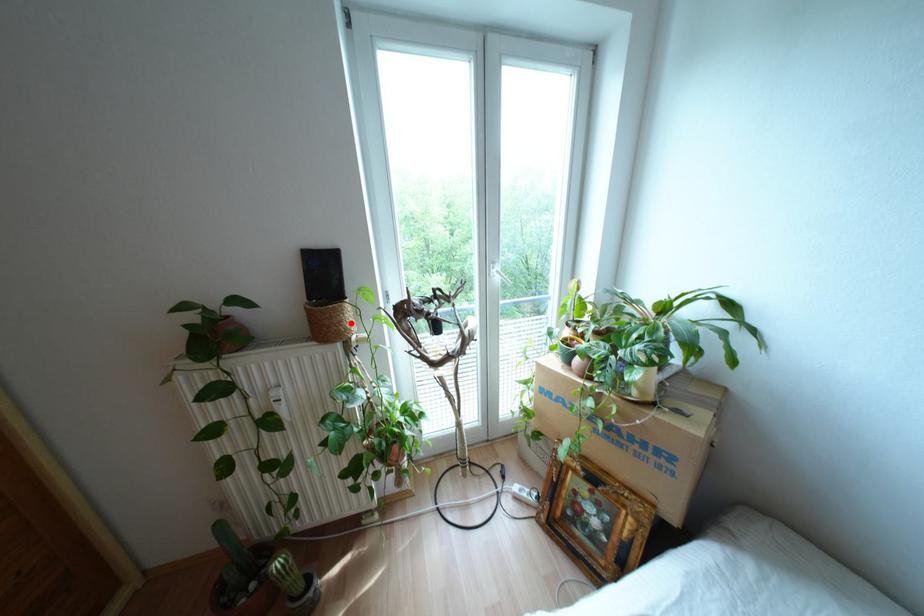
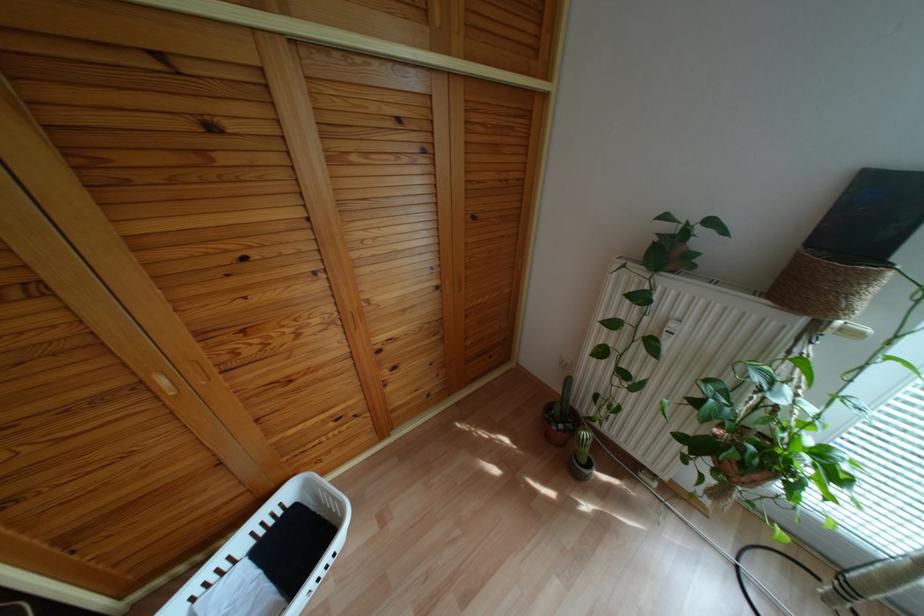
In the second image, find the point that corresponds to the highlighted location in the first image.

(861, 302)